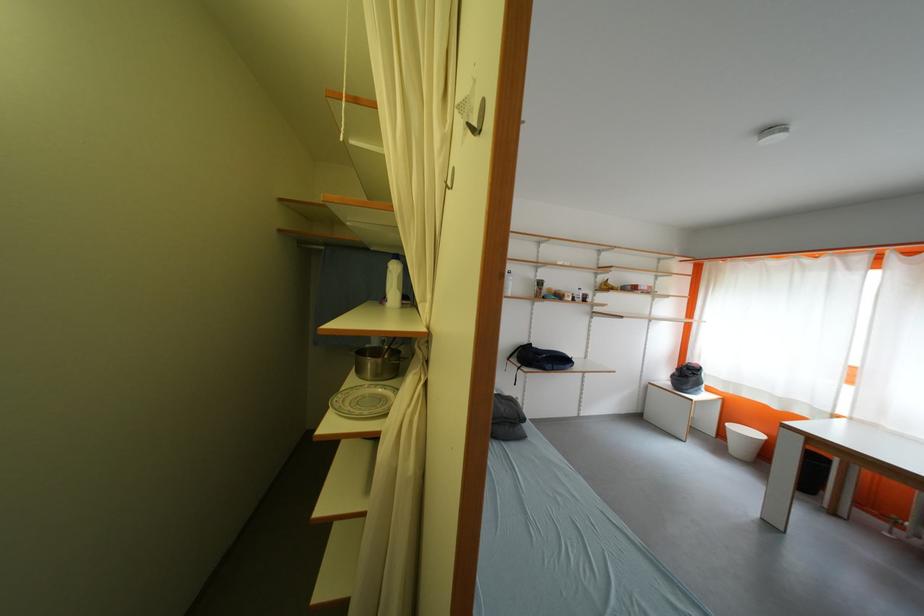
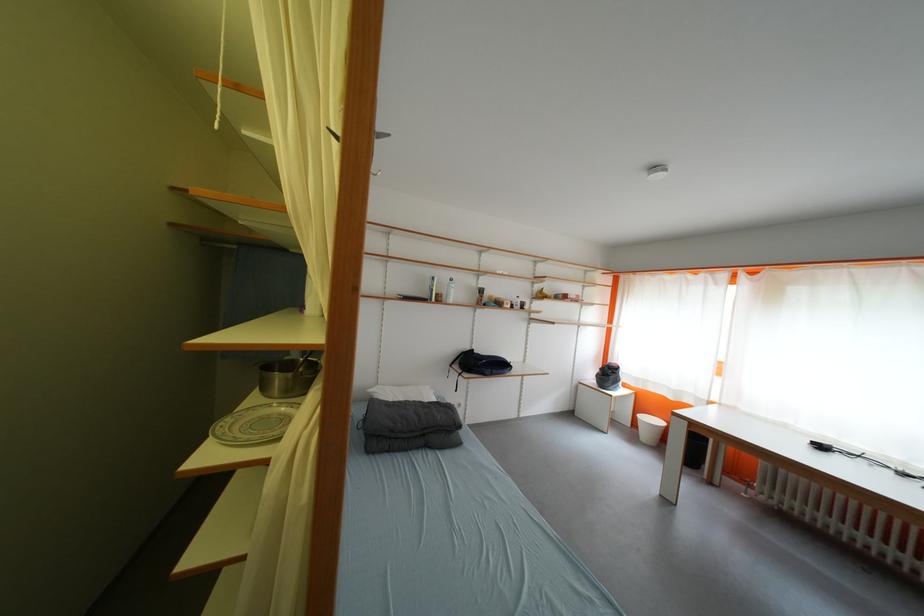
Question: The images are taken continuously from a first-person perspective. In which direction is your viewpoint rotating?

Choices:
 (A) Left
 (B) Right
 (C) Up
 (D) Down

Answer: (B)